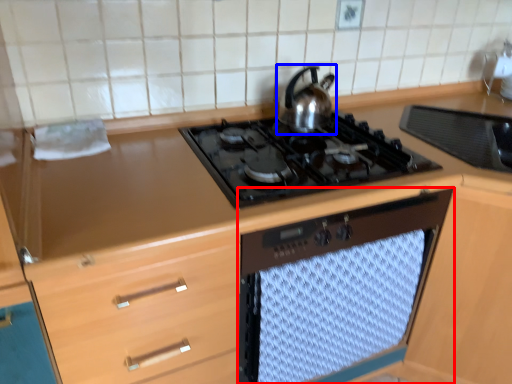
Question: Which object is closer to the camera taking this photo, oven (highlighted by a red box) or kitchen appliance (highlighted by a blue box)?

Choices:
 (A) oven
 (B) kitchen appliance

Answer: (A)